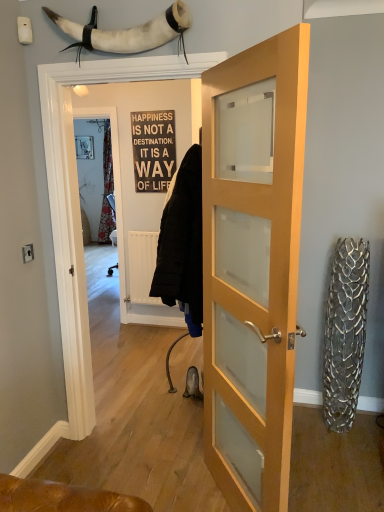
Question: Considering the positions of light wood/glass door at center, acting as the 2th door starting from the left, and white wood sign at center in the image, is light wood/glass door at center, acting as the 2th door starting from the left, bigger or smaller than white wood sign at center?

Choices:
 (A) big
 (B) small

Answer: (A)

Question: Considering the relative positions of light wood/glass door at center, acting as the first door starting from the right, and white wood sign at center in the image provided, is light wood/glass door at center, acting as the first door starting from the right, to the left or to the right of white wood sign at center?

Choices:
 (A) left
 (B) right

Answer: (B)

Question: Considering the real-world distances, which object is farthest from the white wood sign at center?

Choices:
 (A) wooden door at center, arranged as the 1th door when viewed from the left
 (B) light wood/glass door at center, acting as the first door starting from the right
 (C) white leather horn at upper center

Answer: (C)

Question: Considering the real-world distances, which object is farthest from the wooden door at center, arranged as the 1th door when viewed from the left?

Choices:
 (A) white leather horn at upper center
 (B) light wood/glass door at center, acting as the 2th door starting from the left
 (C) white wood sign at center

Answer: (B)